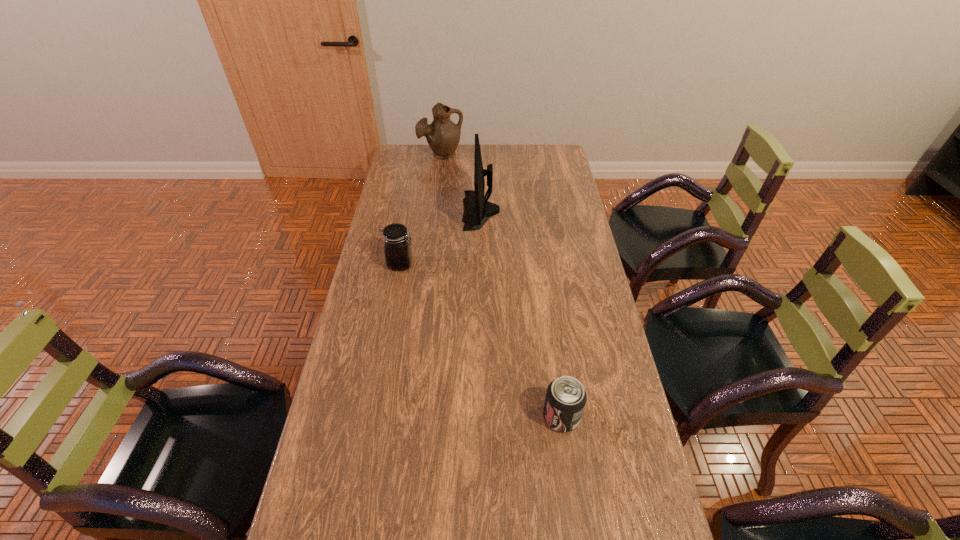
Identify the location of vacant space located on the lid of the third farthest object. This screenshot has height=540, width=960. (499, 264).

Image resolution: width=960 pixels, height=540 pixels. I want to click on free region located on the back of the nearest object, so click(553, 357).

What are the coordinates of `object at the far edge` in the screenshot? It's located at (443, 136).

Where is `pitcher that is at the left edge`? The height and width of the screenshot is (540, 960). pitcher that is at the left edge is located at coordinates (443, 136).

This screenshot has height=540, width=960. I want to click on jar located in the left edge section of the desktop, so click(x=397, y=246).

Where is `object at the right edge`? object at the right edge is located at coordinates (565, 400).

Locate an element on the screen. The height and width of the screenshot is (540, 960). object situated at the far left corner is located at coordinates (443, 136).

Locate an element on the screen. This screenshot has width=960, height=540. vacant space at the far edge of the desktop is located at coordinates (459, 158).

Identify the location of free space at the left edge of the desktop. (389, 209).

Where is `vacant region at the right edge of the desktop`? vacant region at the right edge of the desktop is located at coordinates (549, 207).